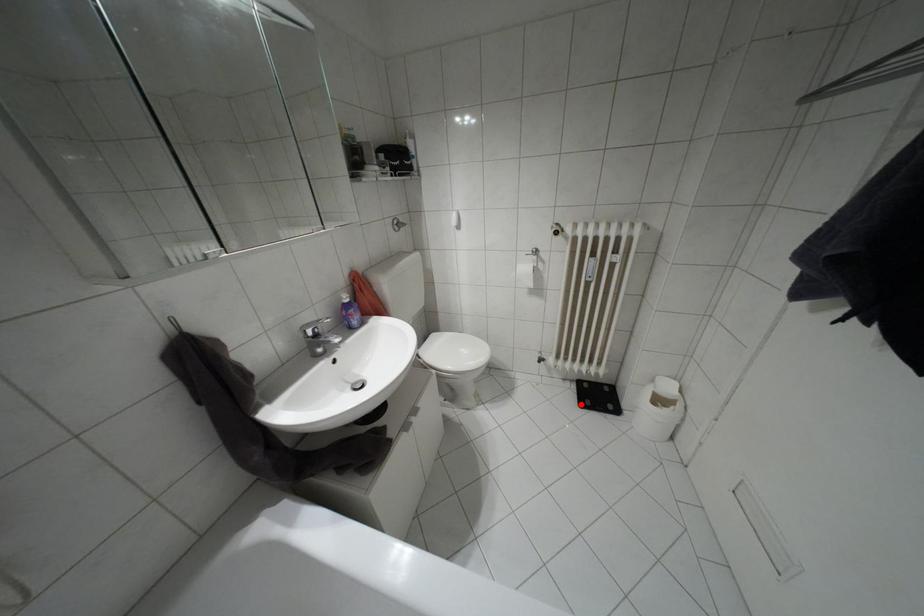
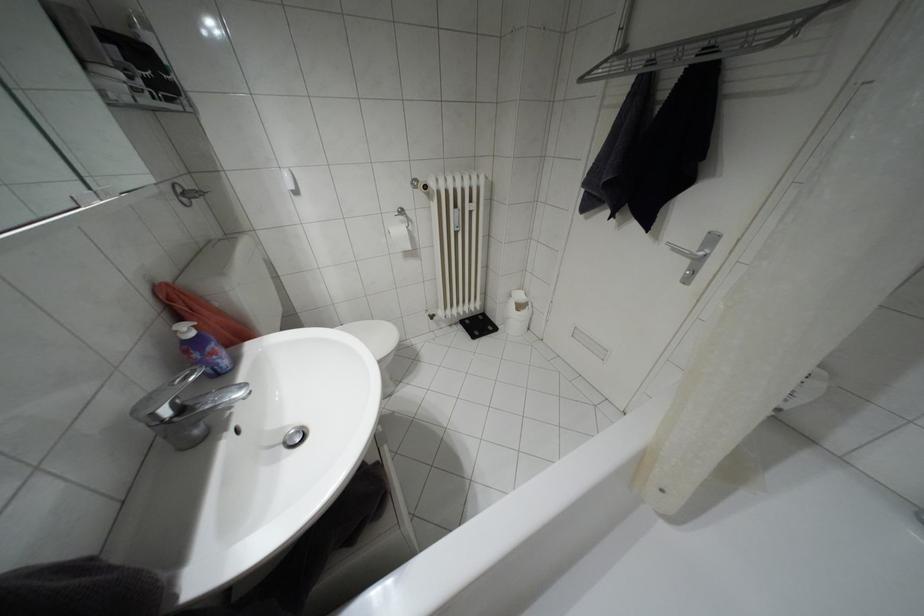
In the second image, find the point that corresponds to the highlighted location in the first image.

(472, 336)